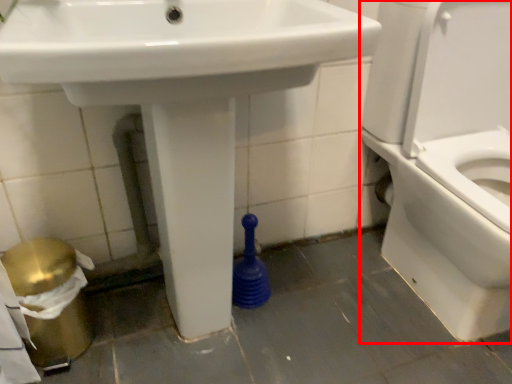
Question: From the image, what is the correct spatial relationship of toilet (annotated by the red box) in relation to sink?

Choices:
 (A) left
 (B) right

Answer: (B)